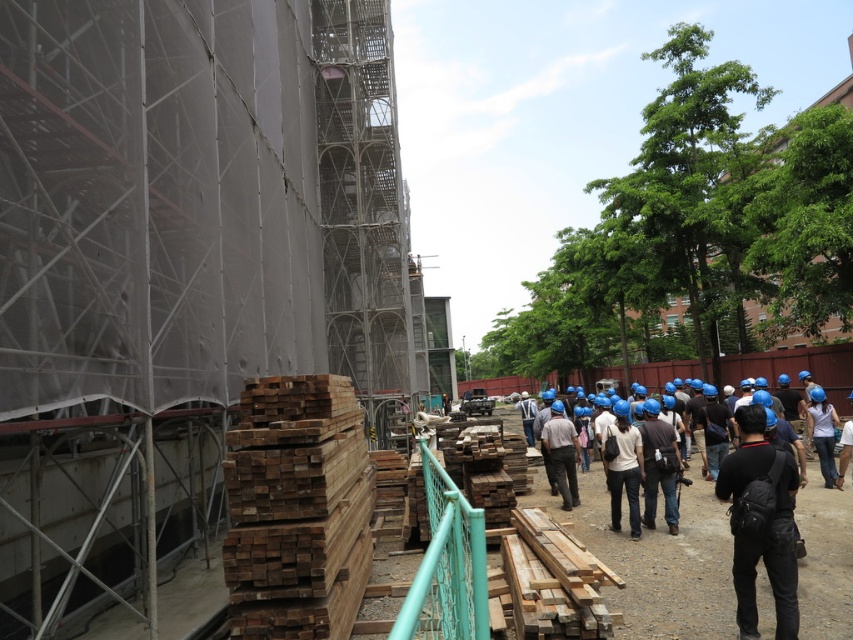
Is weathered wood at lower left to the right of dark gray fabric camera bag at center from the viewer's perspective?

Incorrect, weathered wood at lower left is not on the right side of dark gray fabric camera bag at center.

Find the location of a particular element. weathered wood at lower left is located at coordinates (296, 509).